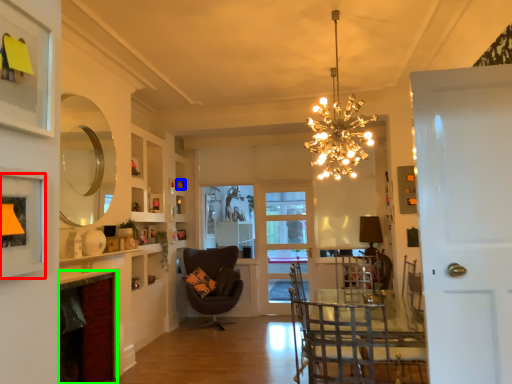
Question: Based on their relative distances, which object is nearer to picture frame (highlighted by a red box)? Choose from picture frame (highlighted by a blue box) and fireplace (highlighted by a green box).

Choices:
 (A) picture frame
 (B) fireplace

Answer: (B)